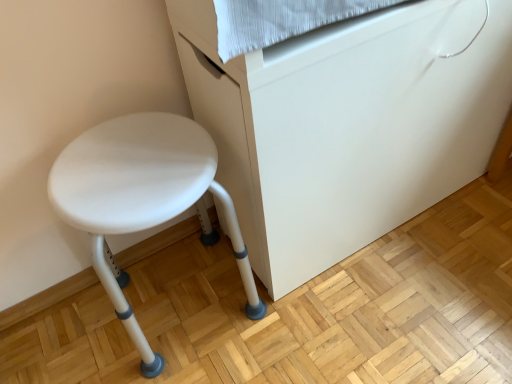
Question: From the image's perspective, is white plastic stool at lower left located above or below white plastic stool at left?

Choices:
 (A) above
 (B) below

Answer: (A)

Question: Looking at the image, does white plastic stool at lower left seem bigger or smaller compared to white plastic stool at left?

Choices:
 (A) small
 (B) big

Answer: (B)

Question: Considering the relative positions of white plastic stool at lower left and white plastic stool at left in the image provided, is white plastic stool at lower left to the left or to the right of white plastic stool at left?

Choices:
 (A) right
 (B) left

Answer: (A)

Question: Is point (105, 122) closer or farther from the camera than point (260, 274)?

Choices:
 (A) farther
 (B) closer

Answer: (B)

Question: Is white plastic stool at left in front of or behind white plastic stool at lower left in the image?

Choices:
 (A) behind
 (B) front

Answer: (A)

Question: Considering the positions of white plastic stool at left and white plastic stool at lower left in the image, is white plastic stool at left taller or shorter than white plastic stool at lower left?

Choices:
 (A) tall
 (B) short

Answer: (B)

Question: Considering the relative positions of white plastic stool at left and white plastic stool at lower left in the image provided, is white plastic stool at left to the left or to the right of white plastic stool at lower left?

Choices:
 (A) right
 (B) left

Answer: (B)